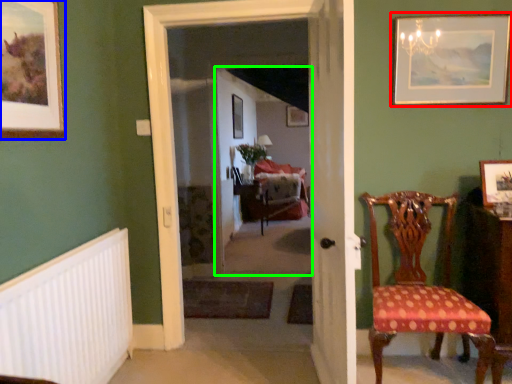
Question: Which object is positioned closest to picture frame (highlighted by a red box)? Select from picture frame (highlighted by a blue box) and corridor (highlighted by a green box).

Choices:
 (A) picture frame
 (B) corridor

Answer: (A)